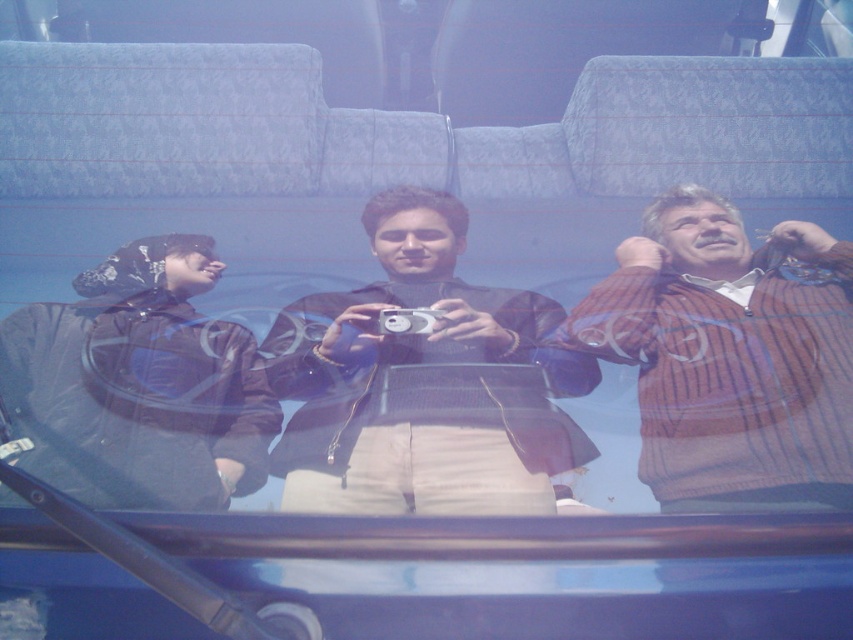
Question: Observing the image, what is the correct spatial positioning of striped sweater at right in reference to black matte jacket at left?

Choices:
 (A) right
 (B) left

Answer: (A)

Question: Which point is farther to the camera?

Choices:
 (A) (426, 320)
 (B) (126, 328)
 (C) (519, 451)
 (D) (724, 243)

Answer: (D)

Question: Which object is the closest to the striped sweater at right?

Choices:
 (A) black matte jacket at left
 (B) silver metallic camera at center

Answer: (B)

Question: Which of the following is the farthest from the observer?

Choices:
 (A) (399, 316)
 (B) (187, 406)

Answer: (A)

Question: Is black matte jacket at left to the left of silver metallic camera at center from the viewer's perspective?

Choices:
 (A) yes
 (B) no

Answer: (A)

Question: Is black matte jacket at center thinner than black matte jacket at left?

Choices:
 (A) yes
 (B) no

Answer: (B)